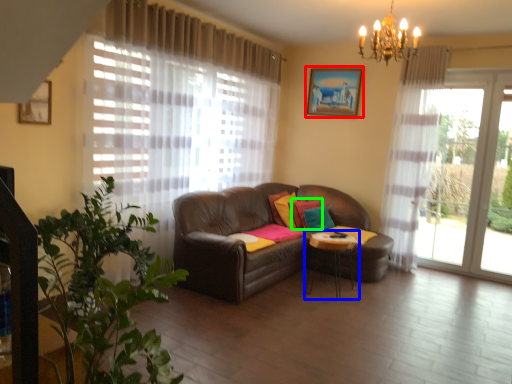
Question: Based on their relative distances, which object is farther from picture frame (highlighted by a red box)? Choose from table (highlighted by a blue box) and pillow (highlighted by a green box).

Choices:
 (A) table
 (B) pillow

Answer: (A)